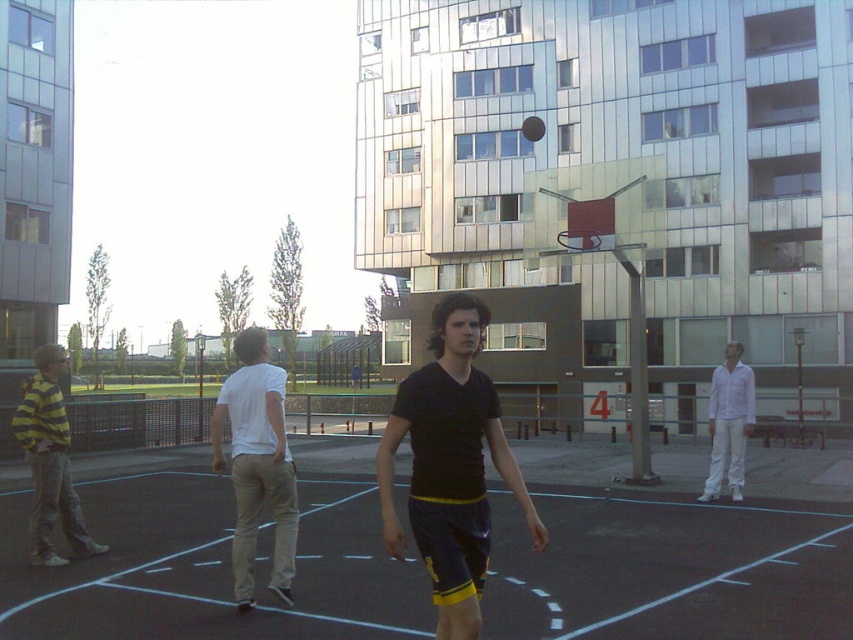
Can you confirm if black matte shorts at center is shorter than shiny black basketball at center?

In fact, black matte shorts at center may be taller than shiny black basketball at center.

Who is shorter, black matte shorts at center or shiny black basketball at center?

With less height is shiny black basketball at center.

Is point (456, 531) behind point (537, 140)?

No, (456, 531) is in front of (537, 140).

Find the location of a particular element. black matte shorts at center is located at coordinates (450, 465).

Can you confirm if yellow striped hoodie at left is smaller than shiny black basketball at center?

No.

Is yellow striped hoodie at left wider than shiny black basketball at center?

Correct, the width of yellow striped hoodie at left exceeds that of shiny black basketball at center.

Is point (45, 492) in front of point (532, 124)?

Yes, it is.

You are a GUI agent. You are given a task and a screenshot of the screen. Output one action in this format:
    pyautogui.click(x=<x>, y=<y>)
    Task: Click on the yellow striped hoodie at left
    
    Given the screenshot: What is the action you would take?
    pyautogui.click(x=50, y=460)

Is black matte shorts at center to the left of white cotton shirt at center from the viewer's perspective?

Incorrect, black matte shorts at center is not on the left side of white cotton shirt at center.

Where is `black matte shorts at center`? black matte shorts at center is located at coordinates (450, 465).